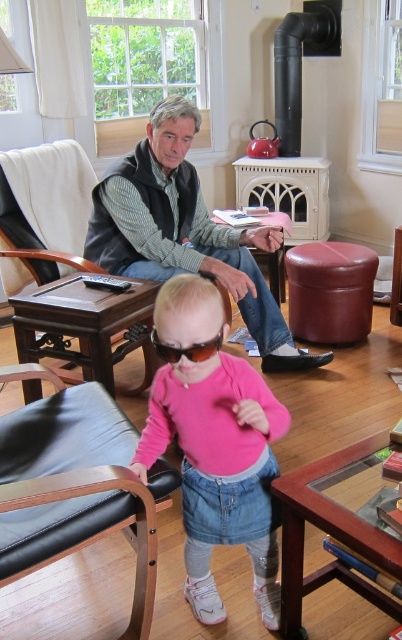
Looking at this image, you are a furniture designer trying to place a new sofa that is 2 meters wide in this living room. You see the black leather armchair at lower left and the gray vest at center. Which object should you consider in terms of space when placing the sofa?

The gray vest at center has a greater width than the black leather armchair at lower left, so you should consider the space around the gray vest at center to ensure the sofa fits properly.

You are a delivery person who needs to place a small package between the black leather armchair at lower left and the coffee table. The package requires at least 1 meter of space to fit. Is there enough space between them?

The distance between the black leather armchair at lower left and the coffee table is 1.29 meters, which is more than the required 1 meter, so the package can be placed there.